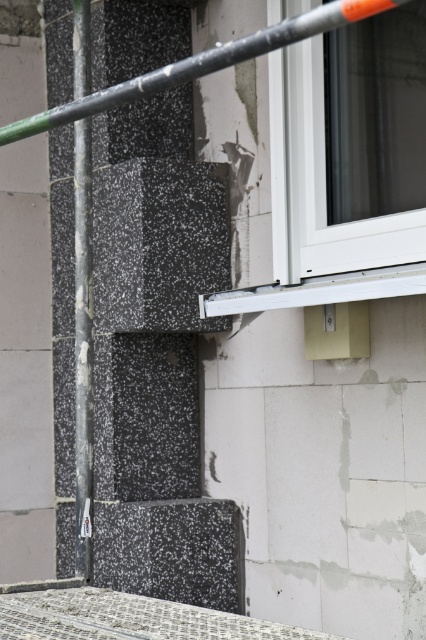
Question: Which point is closer to the camera?

Choices:
 (A) (423, 252)
 (B) (78, 273)

Answer: (A)

Question: Does white plastic window at upper right appear under black textured pole at left?

Choices:
 (A) yes
 (B) no

Answer: (B)

Question: Is black textured pole at left bigger than metallic gray pole at upper center?

Choices:
 (A) yes
 (B) no

Answer: (B)

Question: Among these objects, which one is nearest to the camera?

Choices:
 (A) metallic gray pole at upper center
 (B) black textured pole at left
 (C) white plastic window at upper right

Answer: (A)

Question: Which of the following is the farthest from the observer?

Choices:
 (A) white plastic window at upper right
 (B) black textured pole at left

Answer: (B)

Question: Can you confirm if black textured pole at left is positioned above metallic gray pole at upper center?

Choices:
 (A) no
 (B) yes

Answer: (A)